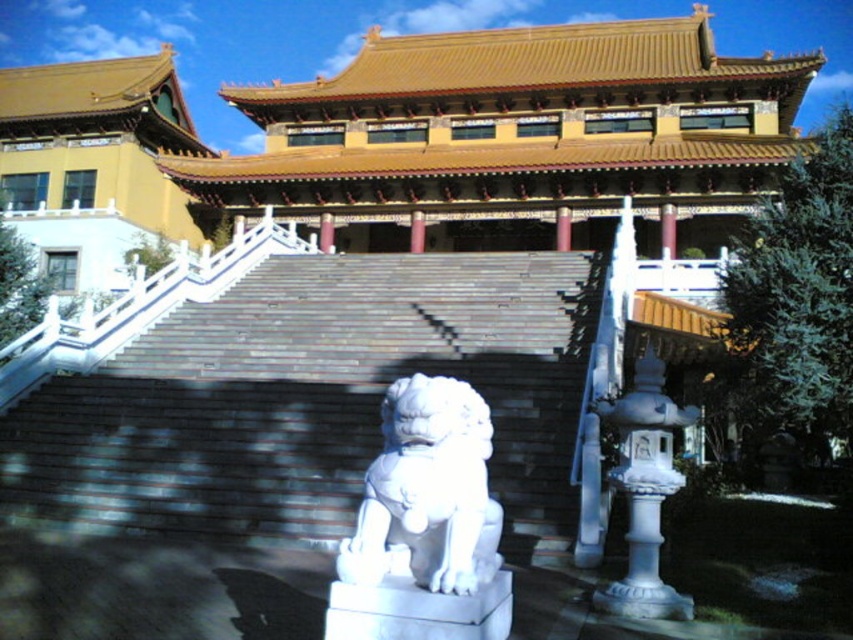
Who is positioned more to the left, white stone stairs at center or white stone lion at center?

Positioned to the left is white stone stairs at center.

Is white stone stairs at center wider than white stone lion at center?

Correct, the width of white stone stairs at center exceeds that of white stone lion at center.

Find the location of a particular element. Image resolution: width=853 pixels, height=640 pixels. white stone stairs at center is located at coordinates (312, 397).